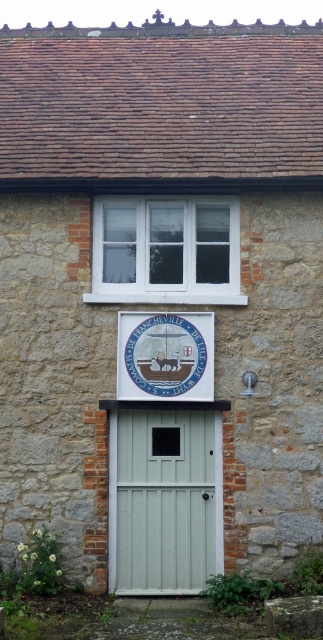
You are standing in front of the stone building and want to enter through the door. Which object, the white painted wood door at center or the white plastic window at upper center, is closer to you?

The white painted wood door at center is closer to the viewer than the white plastic window at upper center.